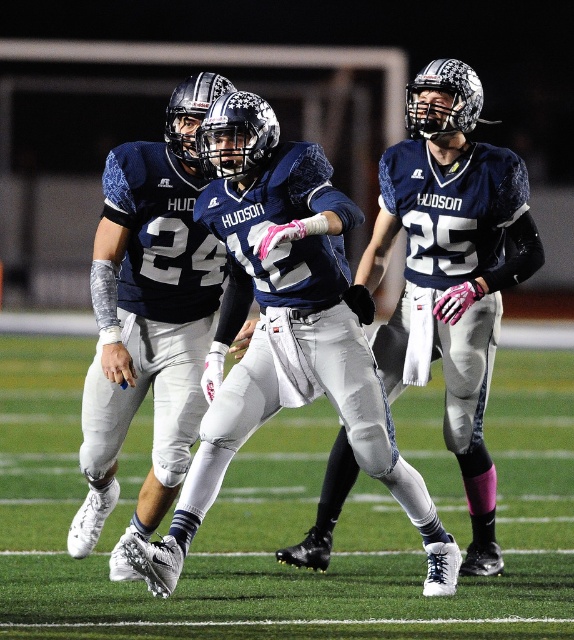
What is located at the coordinates point (280, 522) in the image?

The coordinates point (280, 522) indicate green turf at center.